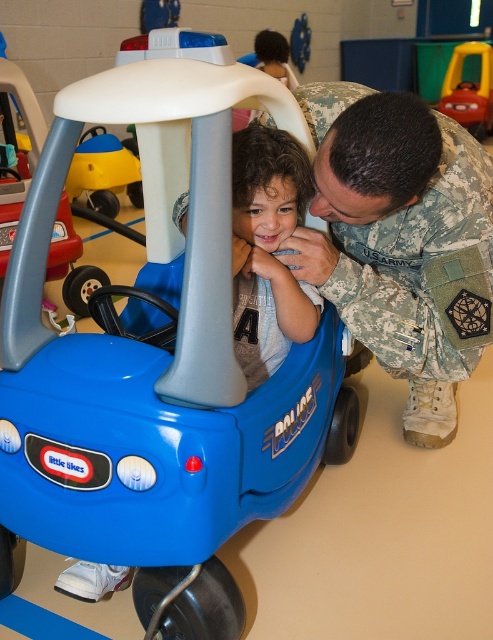
You are a robot navigating an indoor play area. You need to move from the soldier to the child. The soldier is at point [178,115] and the child is at point [69,177]. Since the soldier is in front of the child, will you have to go around the soldier to reach the child?

Point [178,115] is in front of point [69,177], so the soldier is blocking the direct path to the child. You will need to go around the soldier to reach the child.

You are a parent trying to choose between two toy cars for your child. The matte yellow toy car at left and the rubberized plastic car at upper right. Which one is wider?

The rubberized plastic car at upper right is wider than the matte yellow toy car at left.